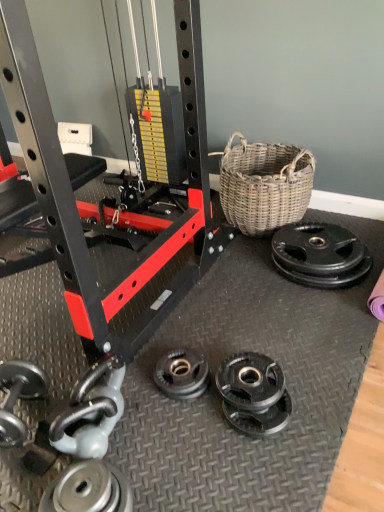
Image resolution: width=384 pixels, height=512 pixels. I want to click on unoccupied area in front of woven natural basket at right, so click(248, 272).